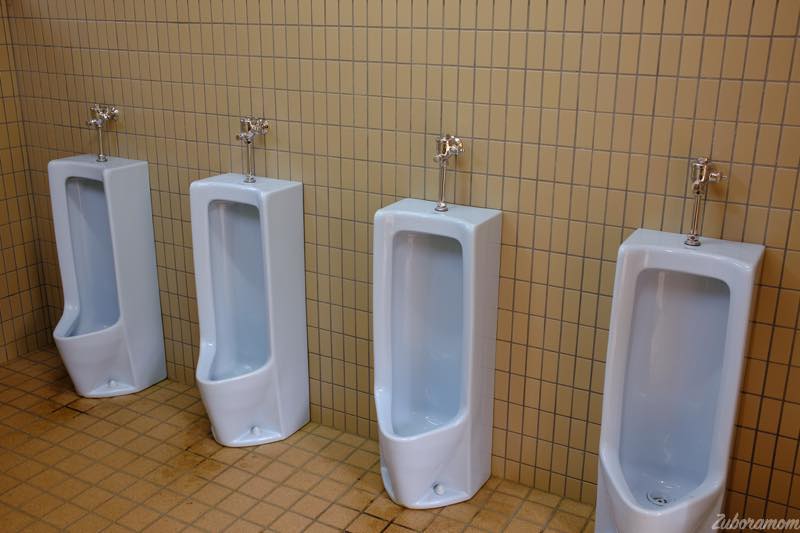
The image size is (800, 533). In order to click on urinals in this screenshot , I will do `click(110, 274)`, `click(254, 305)`, `click(658, 394)`, `click(440, 356)`.